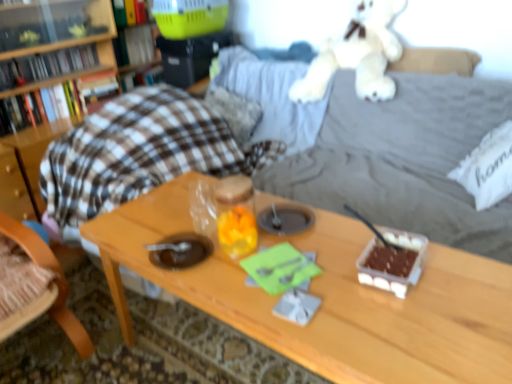
The image size is (512, 384). I want to click on vacant area to the left of translucent plastic container with chocolate at right, so click(x=344, y=284).